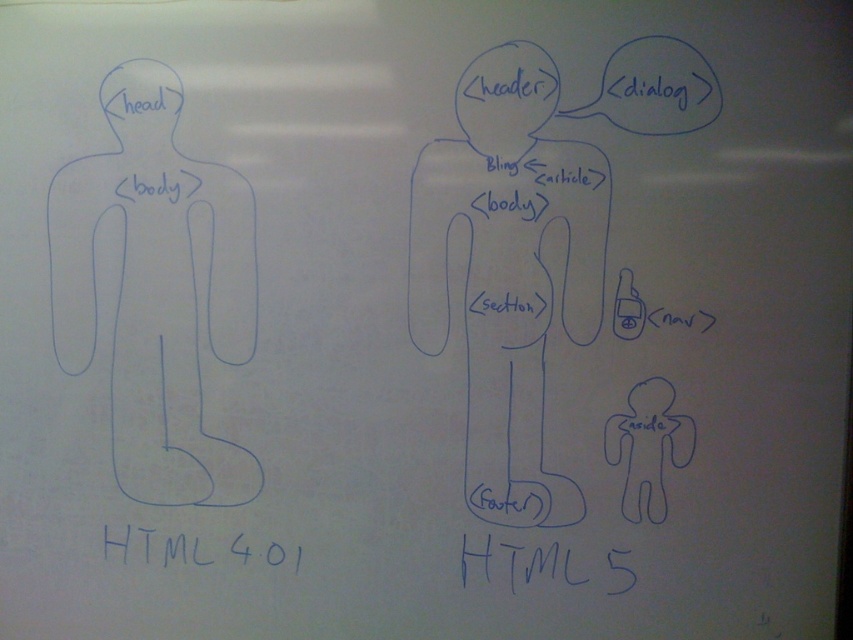
Question: Based on their relative distances, which object is nearer to the blue handwritten text at bottom center?

Choices:
 (A) blue line drawing body at center
 (B) black text at lower left
 (C) blue line drawing of body at left

Answer: (A)

Question: Observing the image, what is the correct spatial positioning of blue line drawing body at center in reference to black text at lower left?

Choices:
 (A) right
 (B) left

Answer: (A)

Question: Is blue line drawing of body at left above black text at lower left?

Choices:
 (A) no
 (B) yes

Answer: (B)

Question: Which point appears farthest from the camera in this image?

Choices:
 (A) (598, 275)
 (B) (221, 561)

Answer: (B)

Question: Which is farther from the blue line drawing body at center?

Choices:
 (A) blue line drawing of body at left
 (B) blue handwritten text at bottom center

Answer: (A)

Question: Is black text at lower left further to the viewer compared to blue handwritten text at bottom center?

Choices:
 (A) yes
 (B) no

Answer: (A)